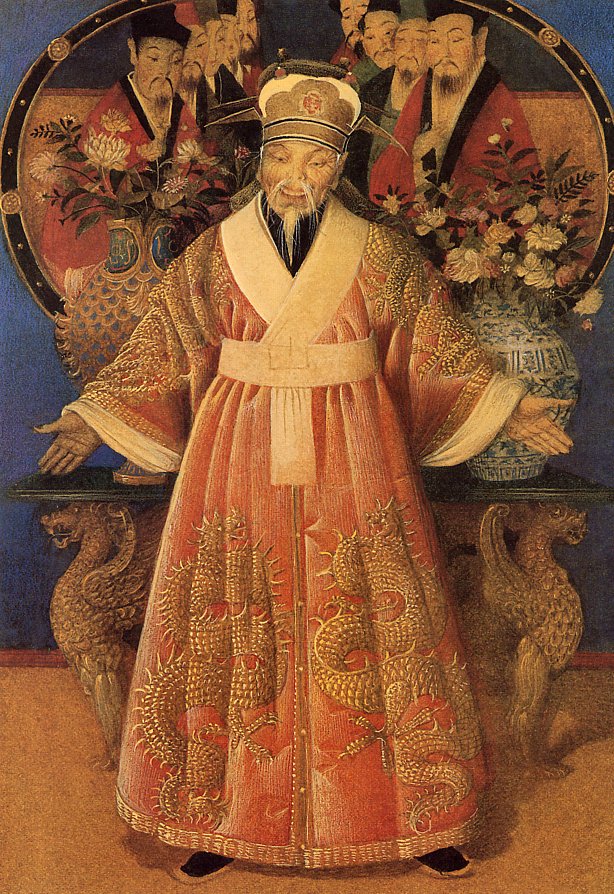
Where is `vase`? This screenshot has height=894, width=614. vase is located at coordinates (546, 359).